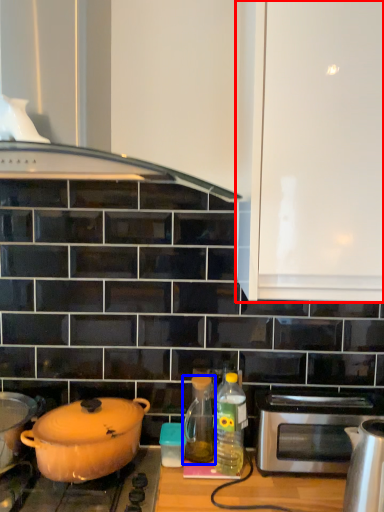
Question: Which of the following is the closest to the observer, cabinetry (highlighted by a red box) or bottle (highlighted by a blue box)?

Choices:
 (A) cabinetry
 (B) bottle

Answer: (A)